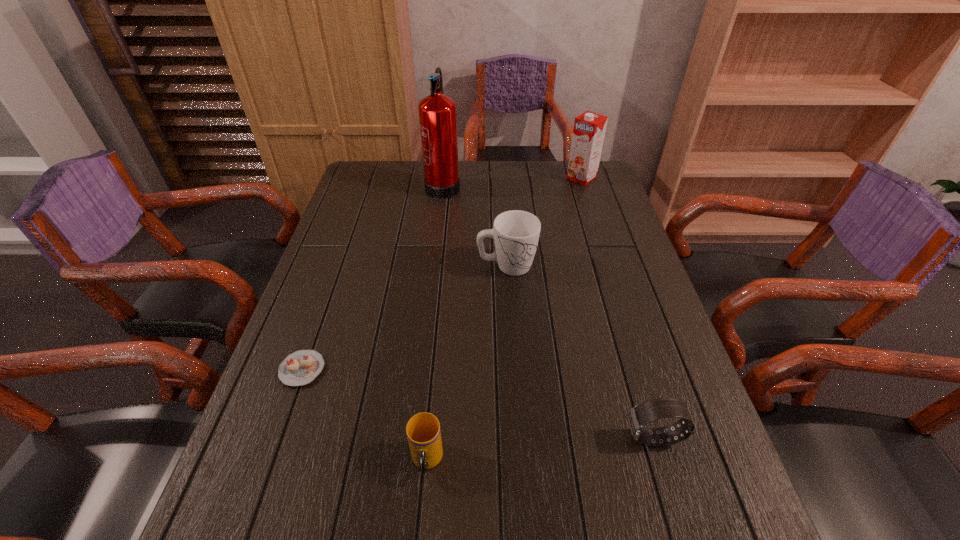
I want to click on the tallest object, so click(437, 112).

I want to click on carton, so click(589, 129).

I want to click on mug, so click(515, 233).

This screenshot has width=960, height=540. I want to click on the fourth nearest object, so click(515, 233).

You are a GUI agent. You are given a task and a screenshot of the screen. Output one action in this format:
    pyautogui.click(x=<x>, y=<y>)
    Task: Click on the watch
    Image resolution: width=960 pixels, height=540 pixels.
    Given the screenshot: What is the action you would take?
    pyautogui.click(x=640, y=415)

Locate an element on the screen. Image resolution: width=960 pixels, height=540 pixels. cup is located at coordinates (x=423, y=431).

Find the location of `the leftmost object`. the leftmost object is located at coordinates (x=301, y=367).

You are a GUI agent. You are given a task and a screenshot of the screen. Output one action in this format:
    pyautogui.click(x=<x>, y=<y>)
    Task: Click on the cupcake
    This screenshot has width=960, height=540.
    Given the screenshot: What is the action you would take?
    pyautogui.click(x=301, y=367)

Find the location of a particular element. Image resolution: width=960 pixels, height=540 pixels. vacant area situated 0.070m on the left of the fire extinguisher is located at coordinates (406, 184).

The width and height of the screenshot is (960, 540). I want to click on free spot located on the front of the carton, so click(598, 229).